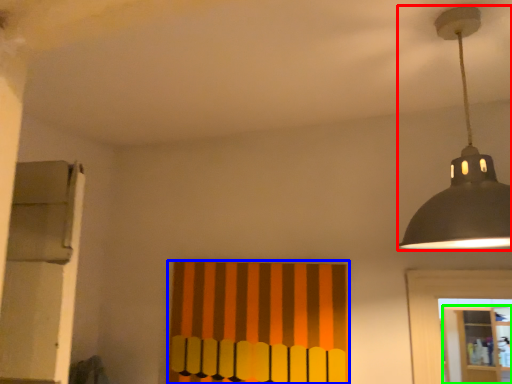
Question: Which object is the closest to the lamp (highlighted by a red box)? Choose among these: curtain (highlighted by a blue box) or shelf (highlighted by a green box).

Choices:
 (A) curtain
 (B) shelf

Answer: (A)